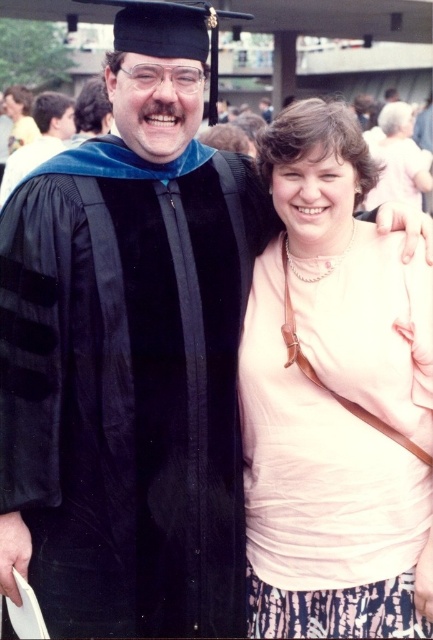
You are a photographer at a graduation ceremony. You want to capture a photo where the pink fabric shirt at center and the matte black graduation gown at upper left are both clearly visible. Based on their positions, which object is closer to the camera?

The pink fabric shirt at center is positioned under the matte black graduation gown at upper left, so the matte black graduation gown at upper left is closer to the camera.

You are a photographer at a graduation ceremony. You want to take a photo of the pink fabric shirt at center and the matte black graduation gown at upper left. Can you fit both subjects into a single frame if your camera has a maximum field of view of 6 meters?

The distance between the pink fabric shirt at center and the matte black graduation gown at upper left is 6.44 meters, which exceeds the camera field of view of 6 meters. Therefore, both subjects cannot be captured in a single frame.